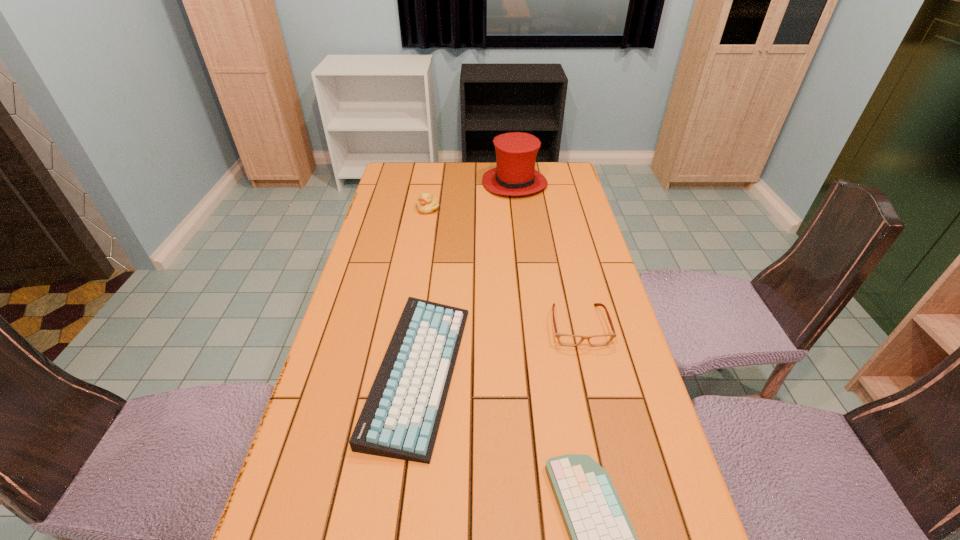
Where is `empty space between the farthest object and the spectacles`? The image size is (960, 540). empty space between the farthest object and the spectacles is located at coordinates (547, 254).

The image size is (960, 540). Find the location of `free space that is in between the farthest object and the spectacles`. free space that is in between the farthest object and the spectacles is located at coordinates (547, 254).

Find the location of `free space between the spectacles and the taller computer keyboard`. free space between the spectacles and the taller computer keyboard is located at coordinates (498, 349).

Locate an element on the screen. free space between the hat and the duckling is located at coordinates [471, 196].

The image size is (960, 540). In order to click on vacant area between the duckling and the spectacles in this screenshot , I will do `click(503, 267)`.

Identify the location of unoccupied position between the duckling and the taller computer keyboard. (423, 291).

This screenshot has height=540, width=960. What are the coordinates of `object that can be found as the third closest to the right computer keyboard` in the screenshot? It's located at (427, 203).

I want to click on object identified as the fourth closest to the second tallest object, so click(x=602, y=539).

Locate an element on the screen. vacant position in the image that satisfies the following two spatial constraints: 1. on the front-facing side of the fourth shortest object; 2. on the left side of the left computer keyboard is located at coordinates (401, 373).

At what (x,y) coordinates should I click in order to perform the action: click on free space in the image that satisfies the following two spatial constraints: 1. on the back side of the left computer keyboard; 2. on the right side of the tallest object. Please return your answer as a coordinate pair (x, y). Looking at the image, I should click on (443, 184).